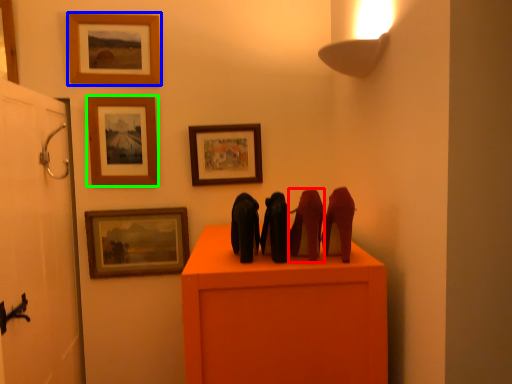
Question: Which object is the closest to the animal (highlighted by a red box)? Choose among these: picture frame (highlighted by a blue box) or picture frame (highlighted by a green box).

Choices:
 (A) picture frame
 (B) picture frame

Answer: (B)